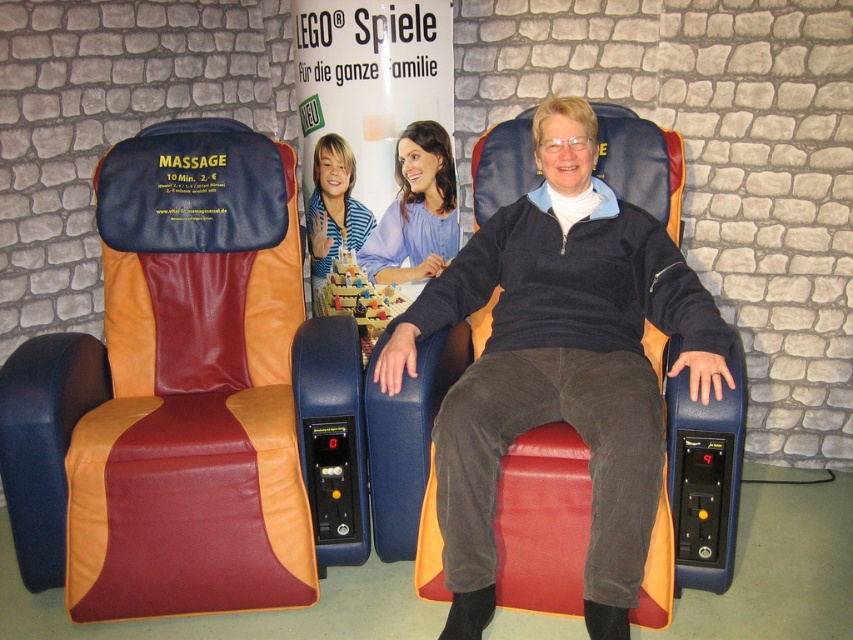
You are a delivery person carrying a box that is 60 centimeters wide. You need to place it between the maroon leather massage chair at left and the matte blue massage chair at center. Is there enough space to fit the box between them?

The distance between the maroon leather massage chair at left and the matte blue massage chair at center is 59.18 centimeters. Since the box is 60 centimeters wide, it is slightly wider than the available space. Therefore, the box cannot fit between them.

You are a customer looking to buy a shirt and see two options displayed in the store window. The matte blue shirt at center and the striped shirt at center. Which shirt is closer to the store window?

The matte blue shirt at center is closer to the store window because it is in front of the striped shirt at center.

You are at a shopping mall and see the maroon leather massage chair at left and the matte blue massage chair at center. Which one is located to the right of the other?

The matte blue massage chair at center is located to the right of the maroon leather massage chair at left.